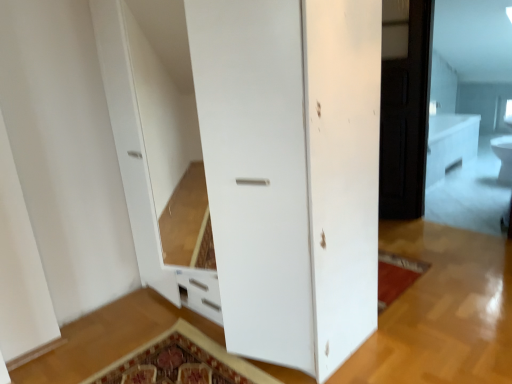
This screenshot has height=384, width=512. Identify the location of white glossy toilet bowl at upper right. (503, 157).

In order to face white glossy toilet bowl at upper right, should I rotate leftwards or rightwards?

To align with it, rotate right about 30.285°.

The width and height of the screenshot is (512, 384). What do you see at coordinates (503, 157) in the screenshot?
I see `white glossy toilet bowl at upper right` at bounding box center [503, 157].

The image size is (512, 384). What do you see at coordinates (405, 114) in the screenshot?
I see `dark wood screen door at right` at bounding box center [405, 114].

Identify the location of dark wood screen door at right. The image size is (512, 384). (405, 114).

The width and height of the screenshot is (512, 384). In order to click on white glossy toilet bowl at upper right in this screenshot , I will do `click(503, 157)`.

Is dark wood screen door at right at the right side of white glossy toilet bowl at upper right?

Incorrect, dark wood screen door at right is not on the right side of white glossy toilet bowl at upper right.

Between dark wood screen door at right and white glossy toilet bowl at upper right, which one is positioned behind?

white glossy toilet bowl at upper right is further from the camera.

Which is behind, point (403, 117) or point (495, 143)?

The point (495, 143) is more distant.

From the image's perspective, is dark wood screen door at right above or below white glossy toilet bowl at upper right?

dark wood screen door at right is above white glossy toilet bowl at upper right.

From a real-world perspective, does dark wood screen door at right sit lower than white glossy toilet bowl at upper right?

Incorrect, from a real-world perspective, dark wood screen door at right is higher than white glossy toilet bowl at upper right.

Considering the relative sizes of dark wood screen door at right and white glossy toilet bowl at upper right in the image provided, is dark wood screen door at right wider than white glossy toilet bowl at upper right?

No.

Who is taller, dark wood screen door at right or white glossy toilet bowl at upper right?

dark wood screen door at right.

Who is smaller, dark wood screen door at right or white glossy toilet bowl at upper right?

white glossy toilet bowl at upper right is smaller.

Would you say dark wood screen door at right contains white glossy toilet bowl at upper right?

Definitely not — white glossy toilet bowl at upper right is not inside dark wood screen door at right.

Is dark wood screen door at right touching white glossy toilet bowl at upper right?

dark wood screen door at right and white glossy toilet bowl at upper right are not in contact.

Could you tell me if dark wood screen door at right is facing white glossy toilet bowl at upper right?

No, dark wood screen door at right is not turned towards white glossy toilet bowl at upper right.

Measure the distance from dark wood screen door at right to white glossy toilet bowl at upper right.

The distance of dark wood screen door at right from white glossy toilet bowl at upper right is 2.27 meters.

The image size is (512, 384). In order to click on screen door above the white glossy toilet bowl at upper right (from the image's perspective) in this screenshot , I will do tap(405, 114).

Is white glossy toilet bowl at upper right to the left or to the right of dark wood screen door at right in the image?

Clearly, white glossy toilet bowl at upper right is on the right of dark wood screen door at right in the image.

Does white glossy toilet bowl at upper right lie behind dark wood screen door at right?

Yes.

Which is behind, point (496, 153) or point (408, 50)?

The point (496, 153) is behind.

From the image's perspective, is white glossy toilet bowl at upper right beneath dark wood screen door at right?

Indeed, from the image's perspective, white glossy toilet bowl at upper right is shown beneath dark wood screen door at right.

From a real-world perspective, is white glossy toilet bowl at upper right above or below dark wood screen door at right?

white glossy toilet bowl at upper right is situated lower than dark wood screen door at right in the real world.

Is white glossy toilet bowl at upper right thinner than dark wood screen door at right?

No.

Can you confirm if white glossy toilet bowl at upper right is shorter than dark wood screen door at right?

Indeed, white glossy toilet bowl at upper right has a lesser height compared to dark wood screen door at right.

In terms of size, does white glossy toilet bowl at upper right appear bigger or smaller than dark wood screen door at right?

white glossy toilet bowl at upper right is smaller than dark wood screen door at right.

Is white glossy toilet bowl at upper right located outside dark wood screen door at right?

Absolutely, white glossy toilet bowl at upper right is external to dark wood screen door at right.

Is white glossy toilet bowl at upper right far from dark wood screen door at right?

Yes, white glossy toilet bowl at upper right is far from dark wood screen door at right.

Could you tell me if white glossy toilet bowl at upper right is turned towards dark wood screen door at right?

No, white glossy toilet bowl at upper right is not turned towards dark wood screen door at right.

How different are the orientations of white glossy toilet bowl at upper right and dark wood screen door at right in degrees?

124 degrees separate the facing orientations of white glossy toilet bowl at upper right and dark wood screen door at right.

Locate an element on the screen. The image size is (512, 384). toilet bowl that appears below the dark wood screen door at right (from a real-world perspective) is located at coordinates (503, 157).

You are a GUI agent. You are given a task and a screenshot of the screen. Output one action in this format:
    pyautogui.click(x=<x>, y=<y>)
    Task: Click on the toilet bowl behind the dark wood screen door at right
    This screenshot has width=512, height=384.
    Given the screenshot: What is the action you would take?
    pyautogui.click(x=503, y=157)

You are a GUI agent. You are given a task and a screenshot of the screen. Output one action in this format:
    pyautogui.click(x=<x>, y=<y>)
    Task: Click on the screen door on the left of white glossy toilet bowl at upper right
    The height and width of the screenshot is (384, 512).
    Given the screenshot: What is the action you would take?
    pyautogui.click(x=405, y=114)